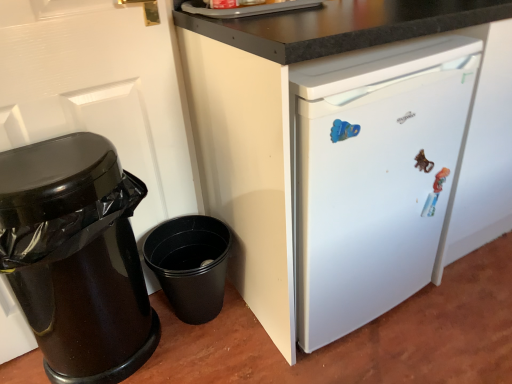
Question: From a real-world perspective, does white glossy door at left sit lower than white matte refrigerator at center?

Choices:
 (A) no
 (B) yes

Answer: (A)

Question: From a real-world perspective, is white glossy door at left on white matte refrigerator at center?

Choices:
 (A) yes
 (B) no

Answer: (A)

Question: Are white glossy door at left and white matte refrigerator at center located far from each other?

Choices:
 (A) yes
 (B) no

Answer: (B)

Question: Does white glossy door at left have a greater height compared to white matte refrigerator at center?

Choices:
 (A) yes
 (B) no

Answer: (A)

Question: Does white glossy door at left lie in front of white matte refrigerator at center?

Choices:
 (A) no
 (B) yes

Answer: (A)

Question: Can white matte refrigerator at center be found inside white glossy door at left?

Choices:
 (A) yes
 (B) no

Answer: (B)

Question: Is white matte refrigerator at center smaller than black glossy trash can at left?

Choices:
 (A) yes
 (B) no

Answer: (B)

Question: Can you confirm if white matte refrigerator at center is thinner than black glossy trash can at left?

Choices:
 (A) yes
 (B) no

Answer: (B)

Question: Does white matte refrigerator at center appear on the right side of black glossy trash can at left?

Choices:
 (A) yes
 (B) no

Answer: (A)

Question: Is the position of white matte refrigerator at center less distant than that of black glossy trash can at left?

Choices:
 (A) no
 (B) yes

Answer: (B)

Question: Is white matte refrigerator at center surrounding black glossy trash can at left?

Choices:
 (A) no
 (B) yes

Answer: (A)

Question: Does white matte refrigerator at center have a larger size compared to black glossy trash can at left?

Choices:
 (A) yes
 (B) no

Answer: (A)

Question: Can you confirm if black glossy trash can at left is wider than white glossy door at left?

Choices:
 (A) no
 (B) yes

Answer: (B)